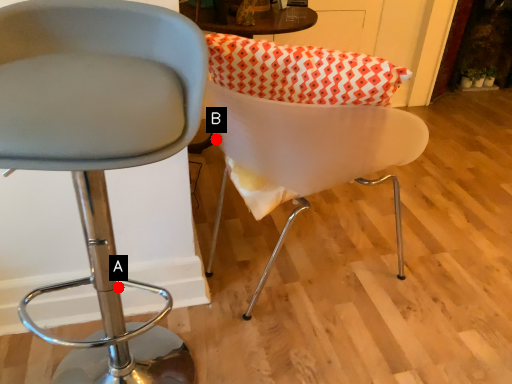
Question: Two points are circled on the image, labeled by A and B beside each circle. Which point is farther to the camera?

Choices:
 (A) A is further
 (B) B is further

Answer: (B)